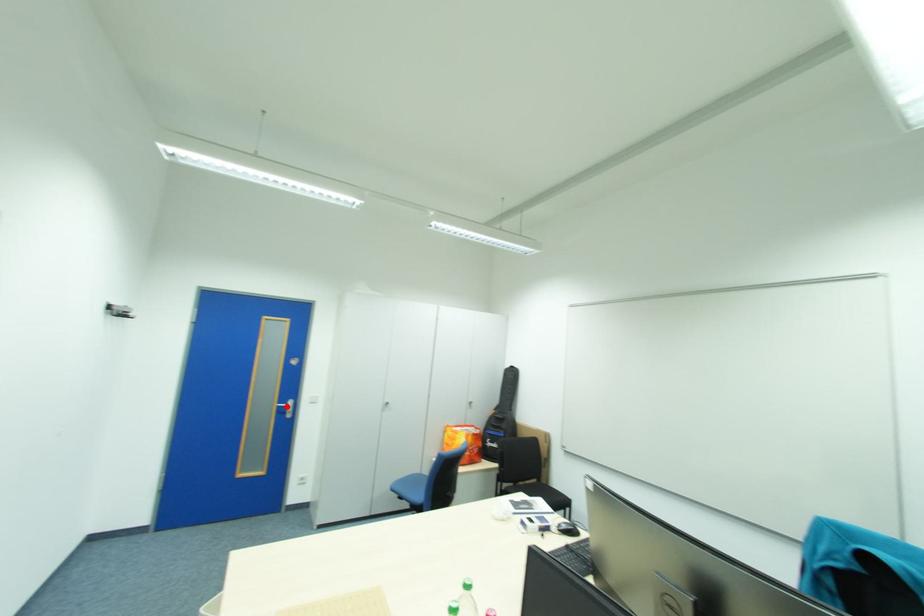
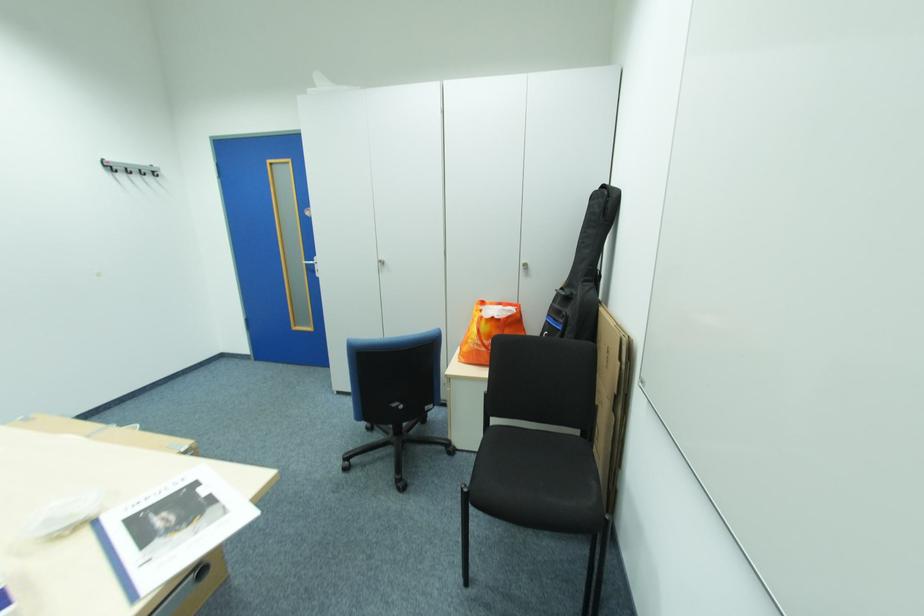
Question: I am providing you with two images of the same scene from different viewpoints. In image1, a red point is highlighted. Considering the same 3D point in image2, which of the following is correct?

Choices:
 (A) It is closer
 (B) It is farther

Answer: (A)